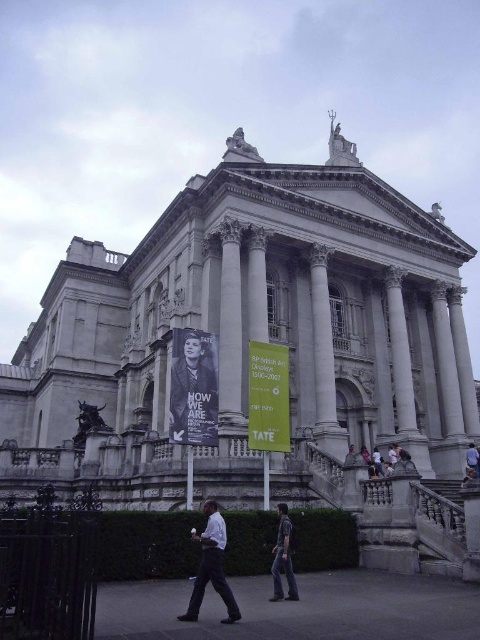
Question: Which point appears closest to the camera in this image?

Choices:
 (A) (256, 432)
 (B) (212, 340)
 (C) (236, 260)
 (D) (223, 573)

Answer: (D)

Question: Which is farther from the white shirt at center?

Choices:
 (A) striped shirt at center
 (B) yellow paper poster at center
 (C) black paper poster at center
 (D) white marble pillar at center

Answer: (D)

Question: Does black paper poster at center lie in front of white shirt at center?

Choices:
 (A) yes
 (B) no

Answer: (B)

Question: Can you confirm if black paper poster at center is thinner than yellow paper poster at center?

Choices:
 (A) yes
 (B) no

Answer: (B)

Question: Which of the following is the farthest from the observer?

Choices:
 (A) (249, 362)
 (B) (222, 224)

Answer: (B)

Question: Can you confirm if black paper poster at center is thinner than white shirt at center?

Choices:
 (A) no
 (B) yes

Answer: (A)